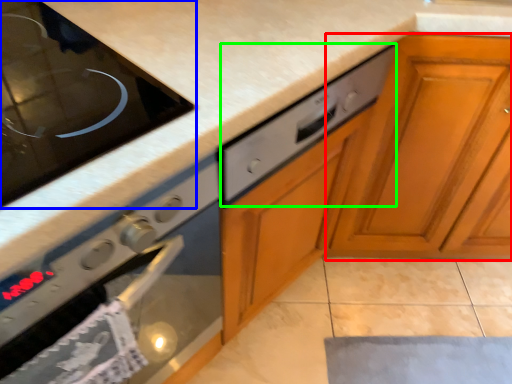
Question: Which is farther away from cabinetry (highlighted by a red box)? home appliance (highlighted by a blue box) or drawer (highlighted by a green box)?

Choices:
 (A) home appliance
 (B) drawer

Answer: (A)